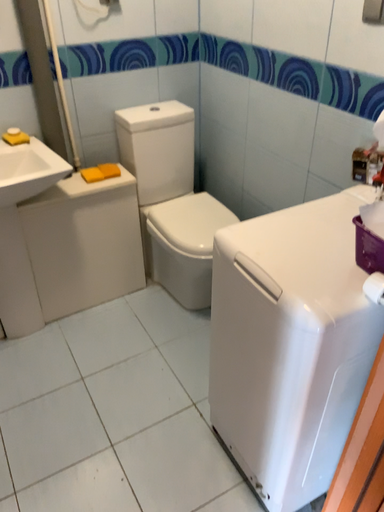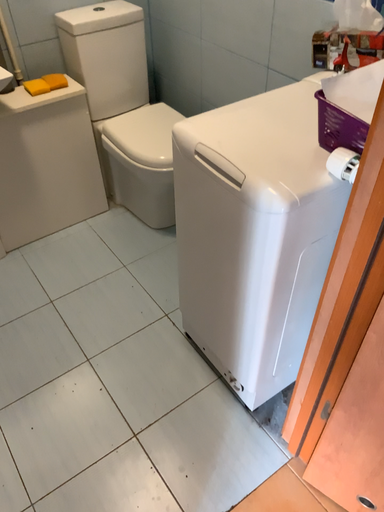
Question: Which way did the camera rotate in the video?

Choices:
 (A) rotated upward
 (B) rotated downward

Answer: (B)